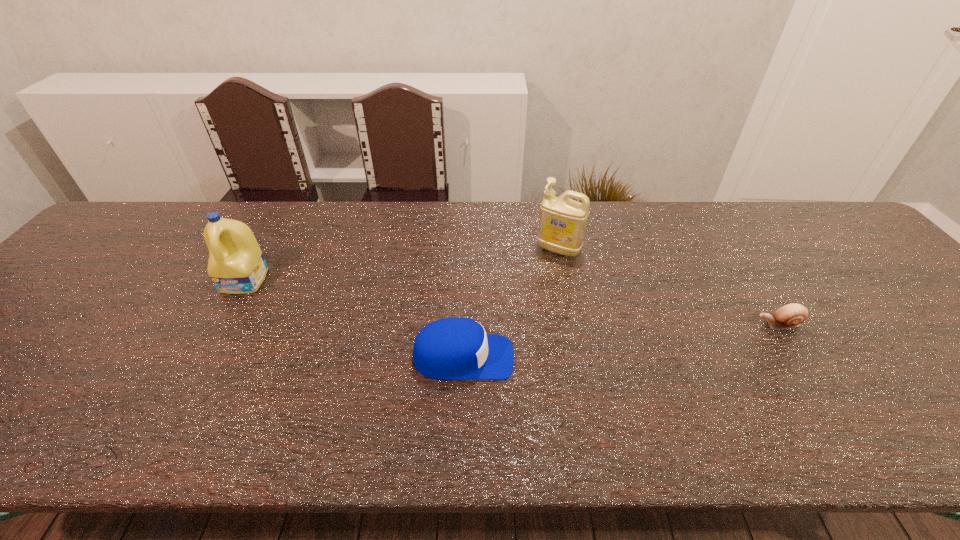
Locate an element on the screen. The image size is (960, 540). free spot located on the front-facing side of the second shortest object is located at coordinates (545, 357).

Identify the location of free space located on the front-facing side of the shortest object. (640, 325).

Where is `vacant space situated 0.130m on the front-facing side of the shortest object`? This screenshot has height=540, width=960. vacant space situated 0.130m on the front-facing side of the shortest object is located at coordinates (699, 325).

Locate an element on the screen. Image resolution: width=960 pixels, height=540 pixels. vacant space situated on the front-facing side of the shortest object is located at coordinates [x=607, y=325].

The image size is (960, 540). In order to click on object situated at the far edge in this screenshot , I will do `click(562, 223)`.

The image size is (960, 540). I want to click on vacant space at the far edge, so click(771, 228).

You are a GUI agent. You are given a task and a screenshot of the screen. Output one action in this format:
    pyautogui.click(x=<x>, y=<y>)
    Task: Click on the vacant space at the near edge
    
    Given the screenshot: What is the action you would take?
    pyautogui.click(x=925, y=452)

In the image, there is a desktop. Identify the location of free space at the right edge. Image resolution: width=960 pixels, height=540 pixels. (900, 296).

Image resolution: width=960 pixels, height=540 pixels. In order to click on blank region between the third nearest object and the second shortest object in this screenshot , I will do `click(354, 319)`.

This screenshot has width=960, height=540. Identify the location of free space between the rightmost object and the right detergent. (668, 287).